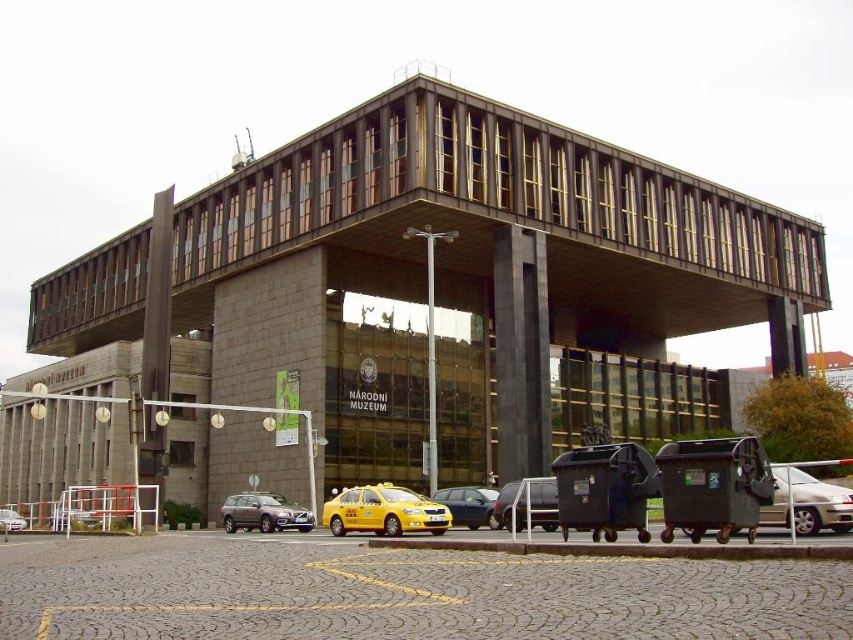
You are a visitor arriving at the NARODNI MUZEUM. You see a metallic silver car at lower center and a silver metallic sedan at lower left. Which vehicle is closer to the entrance of the museum?

The metallic silver car at lower center is closer to the entrance of the NARODNI MUZEUM because it is positioned in front of the silver metallic sedan at lower left, which is further away.

You are a delivery person arriving at the NARODNI MUZEUM. You need to unload a package that requires a clearance of 6 feet. Considering the matte gray suv at center and the silver metallic sedan at lower left, which vehicle should you avoid parking under the museum entrance due to height restrictions?

The matte gray suv at center has a greater height compared to the silver metallic sedan at lower left. Therefore, you should avoid parking the matte gray suv at center under the museum entrance because it may not meet the 6 feet clearance requirement.

You are a pedestrian standing at the entrance of NARODNI MUZEUM and want to cross the paved area to reach the parking meter located behind the vehicles. Which vehicle should you go around first, the matte gray suv at center or the metallic yellow taxi at center?

The matte gray suv at center is located below the metallic yellow taxi at center, so you should go around the metallic yellow taxi at center first as it is closer to you.